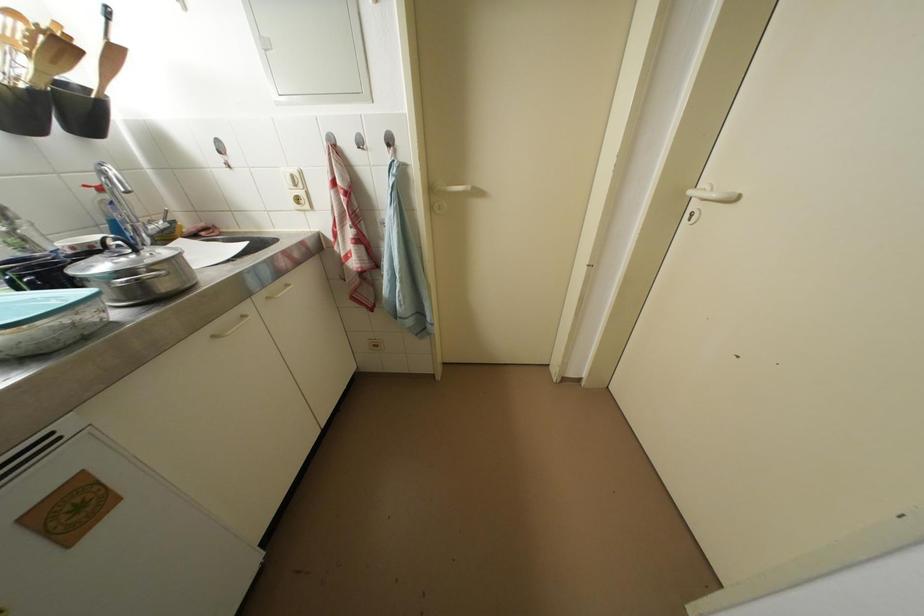
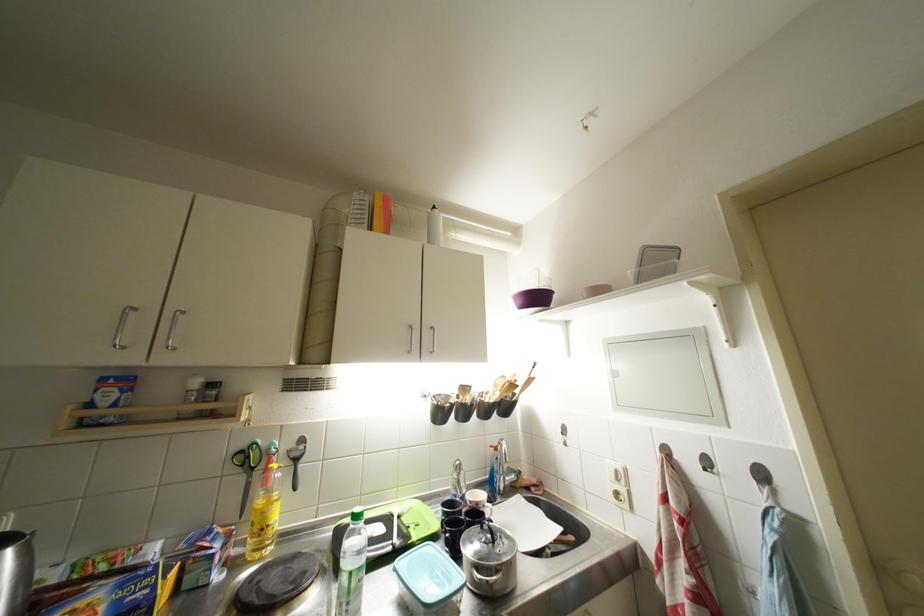
First-person continuous shooting, in which direction is the camera rotating?

The camera's rotation is toward left-up.